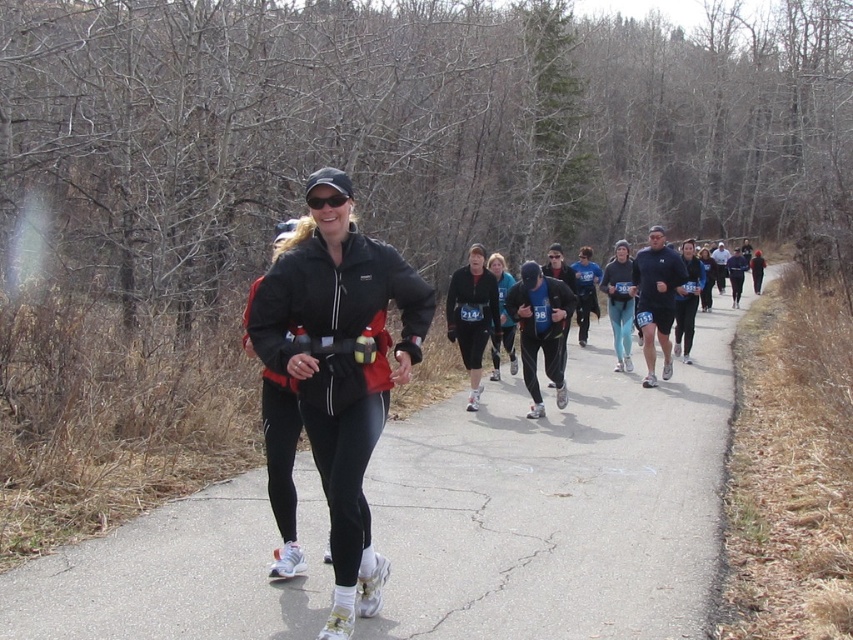
Question: Based on their relative distances, which object is nearer to the blue fabric running outfit at center?

Choices:
 (A) black fabric runner at center
 (B) matte black jacket at center
 (C) black matte jacket at center

Answer: (A)

Question: Which point is closer to the camera?

Choices:
 (A) (477, 252)
 (B) (349, 515)

Answer: (B)

Question: Among these points, which one is nearest to the camera?

Choices:
 (A) (357, 250)
 (B) (656, 262)
 (C) (492, 291)
 (D) (505, 380)

Answer: (A)

Question: Where is black fabric runner at center located in relation to matte black jacket at center in the image?

Choices:
 (A) below
 (B) above

Answer: (A)

Question: Can you confirm if black fabric runner at center is positioned to the left of matte black jacket at center?

Choices:
 (A) no
 (B) yes

Answer: (A)

Question: Considering the relative positions of black fabric runner at center and black matte jacket at center in the image provided, where is black fabric runner at center located with respect to black matte jacket at center?

Choices:
 (A) right
 (B) left

Answer: (A)